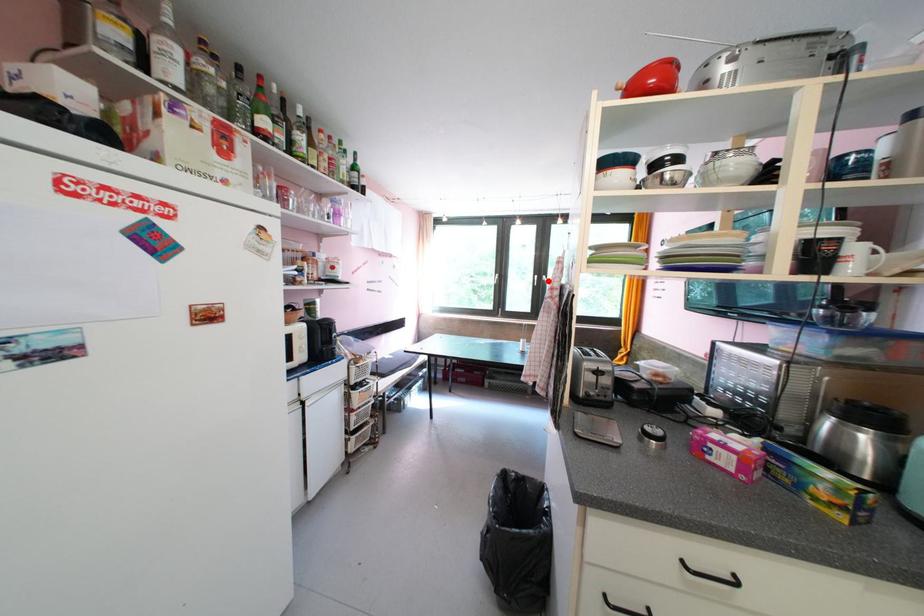
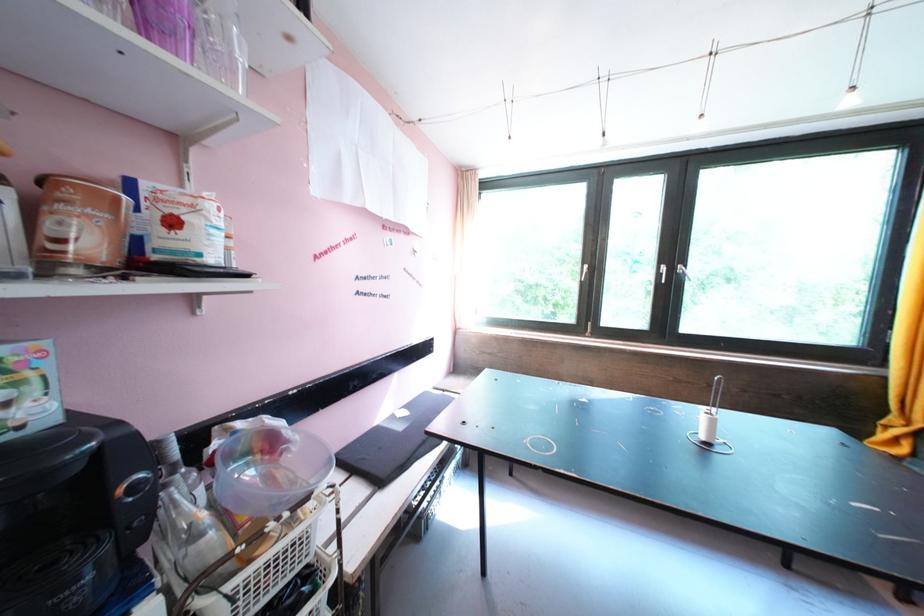
Question: I am providing you with two images of the same scene from different viewpoints. A red point is shown in image1. For the corresponding object point in image2, is it positioned nearer or farther from the camera?

Choices:
 (A) Nearer
 (B) Farther

Answer: (B)